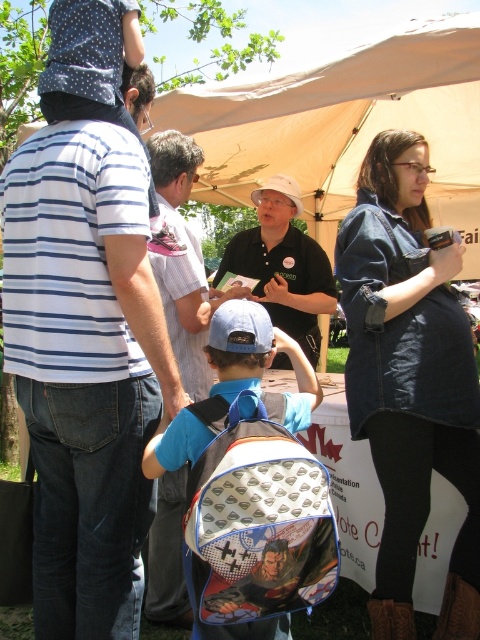
Question: Can you confirm if beige canvas tent at center is positioned to the left of white matte hat at center?

Choices:
 (A) no
 (B) yes

Answer: (A)

Question: Which point is closer to the camera?

Choices:
 (A) denim jacket at upper right
 (B) beige canvas tent at center

Answer: (A)

Question: Estimate the real-world distances between objects in this image. Which object is farther from the beige canvas tent at center?

Choices:
 (A) blue striped shirt at center
 (B) blue fabric backpack at center
 (C) printed fabric backpack at center
 (D) white matte hat at center

Answer: (C)

Question: Can you confirm if blue fabric backpack at center is bigger than white matte hat at center?

Choices:
 (A) no
 (B) yes

Answer: (A)

Question: Is denim jacket at upper right behind blue fabric backpack at center?

Choices:
 (A) yes
 (B) no

Answer: (B)

Question: Which point appears farthest from the camera in this image?

Choices:
 (A) (469, 140)
 (B) (300, 292)
 (C) (110, 188)
 (D) (194, 340)

Answer: (A)